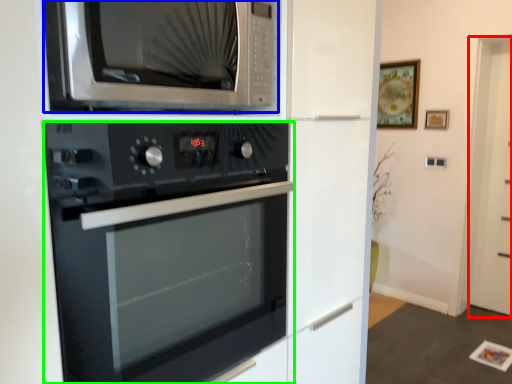
Question: Which object is positioned farthest from glass door (highlighted by a red box)? Select from microwave oven (highlighted by a blue box) and oven (highlighted by a green box).

Choices:
 (A) microwave oven
 (B) oven

Answer: (A)